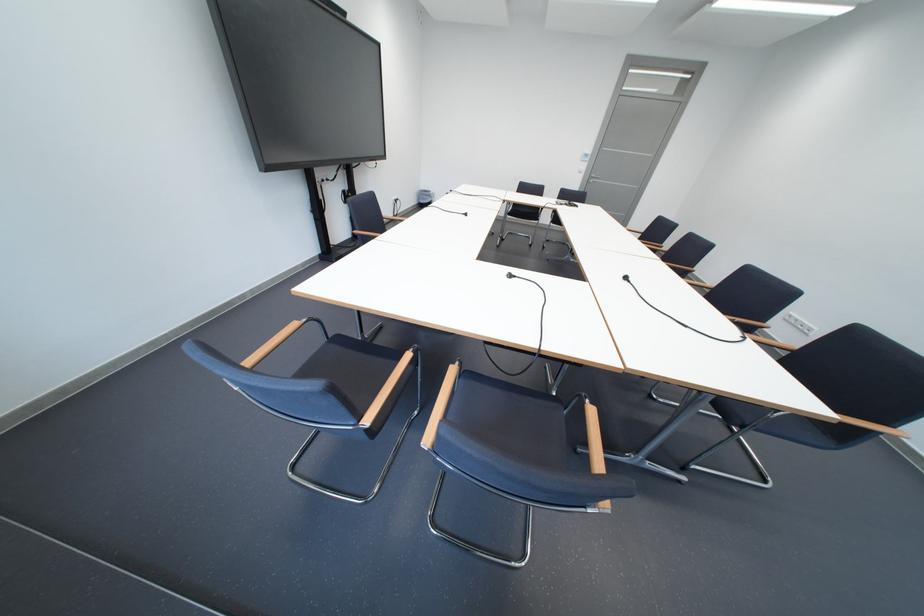
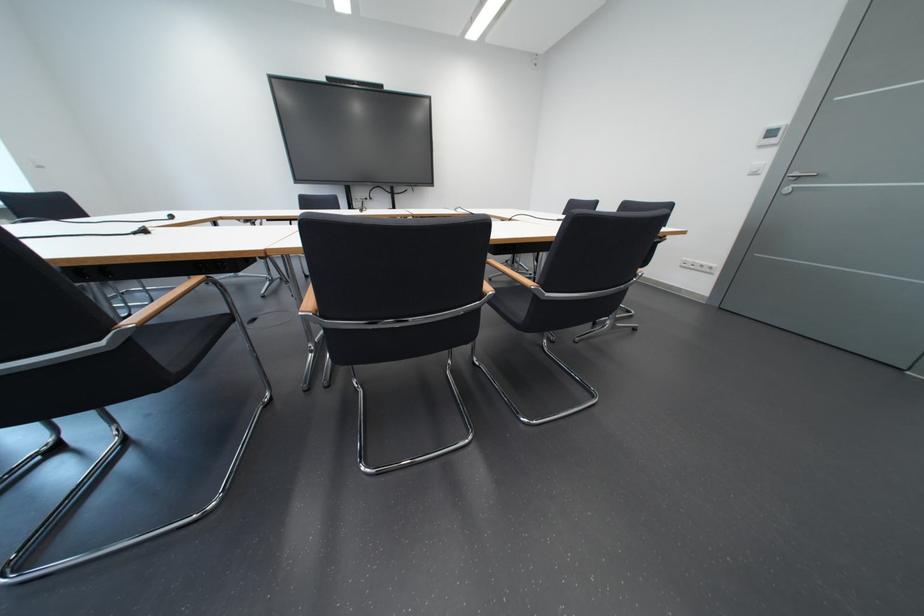
Question: I am providing you with two images of the same scene from different viewpoints. Please identify which objects are invisible in image2.

Choices:
 (A) large plastic roll
 (B) wooden chair armrest
 (C) black chair sitting surface
 (D) blue chair sitting surface

Answer: (D)